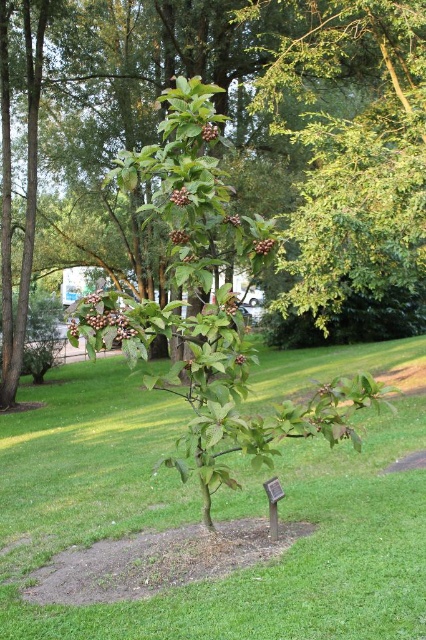
Between purple glossy berries at center and brown matte berries at center, which one appears on the right side from the viewer's perspective?

brown matte berries at center

Does purple glossy berries at center come behind brown matte berries at center?

No, purple glossy berries at center is in front of brown matte berries at center.

What do you see at coordinates (100, 317) in the screenshot?
I see `purple glossy berries at center` at bounding box center [100, 317].

The width and height of the screenshot is (426, 640). I want to click on purple glossy berries at center, so click(x=100, y=317).

Can you confirm if green glossy tree at upper center is positioned to the right of brown matte berries at center?

Correct, you'll find green glossy tree at upper center to the right of brown matte berries at center.

Does point (301, 305) lie in front of point (253, 241)?

No.

Where is `green glossy tree at upper center`? green glossy tree at upper center is located at coordinates (351, 147).

Does green leafy tree at center come behind glossy berry at center?

That is True.

Who is positioned more to the left, green leafy tree at center or glossy berry at center?

Positioned to the left is glossy berry at center.

The height and width of the screenshot is (640, 426). What are the coordinates of `green leafy tree at center` in the screenshot? It's located at (275, 160).

Identify the location of green leafy tree at center. This screenshot has width=426, height=640. (275, 160).